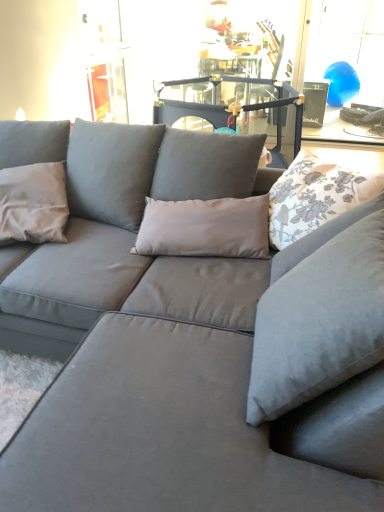
Question: Does blue glossy balloon at upper right appear on the right side of white floral fabric pillow at upper right, arranged as the second pillow when viewed from the left?

Choices:
 (A) yes
 (B) no

Answer: (A)

Question: From a real-world perspective, is blue glossy balloon at upper right over white floral fabric pillow at upper right, arranged as the second pillow when viewed from the left?

Choices:
 (A) no
 (B) yes

Answer: (A)

Question: From the image's perspective, does blue glossy balloon at upper right appear higher than white floral fabric pillow at upper right, acting as the 1th pillow starting from the right?

Choices:
 (A) yes
 (B) no

Answer: (A)

Question: Can you confirm if blue glossy balloon at upper right is positioned to the left of white floral fabric pillow at upper right, arranged as the second pillow when viewed from the left?

Choices:
 (A) yes
 (B) no

Answer: (B)

Question: Is blue glossy balloon at upper right behind white floral fabric pillow at upper right, acting as the 1th pillow starting from the right?

Choices:
 (A) yes
 (B) no

Answer: (A)

Question: Would you say white floral fabric pillow at upper right, acting as the 1th pillow starting from the right, is to the left or to the right of blue glossy balloon at upper right in the picture?

Choices:
 (A) right
 (B) left

Answer: (B)

Question: Is white floral fabric pillow at upper right, acting as the 1th pillow starting from the right, in front of or behind blue glossy balloon at upper right in the image?

Choices:
 (A) front
 (B) behind

Answer: (A)

Question: Considering the positions of white floral fabric pillow at upper right, acting as the 1th pillow starting from the right, and blue glossy balloon at upper right in the image, is white floral fabric pillow at upper right, acting as the 1th pillow starting from the right, wider or thinner than blue glossy balloon at upper right?

Choices:
 (A) thin
 (B) wide

Answer: (B)

Question: From a real-world perspective, relative to blue glossy balloon at upper right, is white floral fabric pillow at upper right, arranged as the second pillow when viewed from the left, vertically above or below?

Choices:
 (A) above
 (B) below

Answer: (A)

Question: From a real-world perspective, relative to matte gray pillow at left, the first pillow from the left, is blue glossy balloon at upper right vertically above or below?

Choices:
 (A) below
 (B) above

Answer: (B)

Question: In the image, is blue glossy balloon at upper right on the left side or the right side of matte gray pillow at left, the first pillow from the left?

Choices:
 (A) right
 (B) left

Answer: (A)

Question: Considering their positions, is blue glossy balloon at upper right located in front of or behind matte gray pillow at left, the first pillow from the left?

Choices:
 (A) front
 (B) behind

Answer: (B)

Question: Is blue glossy balloon at upper right wider or thinner than matte gray pillow at left, the first pillow from the left?

Choices:
 (A) thin
 (B) wide

Answer: (A)

Question: Considering their positions, is matte gray pillow at left, the 2th pillow positioned from the right, located in front of or behind white floral fabric pillow at upper right, arranged as the second pillow when viewed from the left?

Choices:
 (A) front
 (B) behind

Answer: (B)

Question: Considering the positions of matte gray pillow at left, the first pillow from the left, and white floral fabric pillow at upper right, arranged as the second pillow when viewed from the left, in the image, is matte gray pillow at left, the first pillow from the left, taller or shorter than white floral fabric pillow at upper right, arranged as the second pillow when viewed from the left,?

Choices:
 (A) short
 (B) tall

Answer: (B)